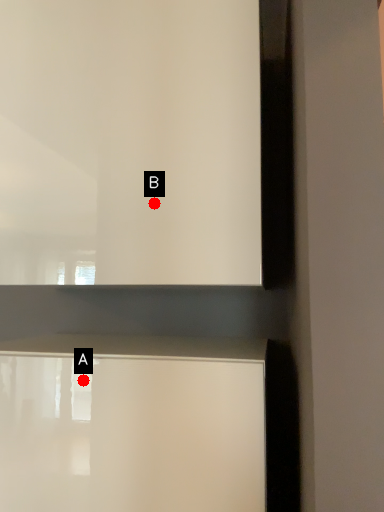
Question: Two points are circled on the image, labeled by A and B beside each circle. Which point appears closest to the camera in this image?

Choices:
 (A) A is closer
 (B) B is closer

Answer: (A)